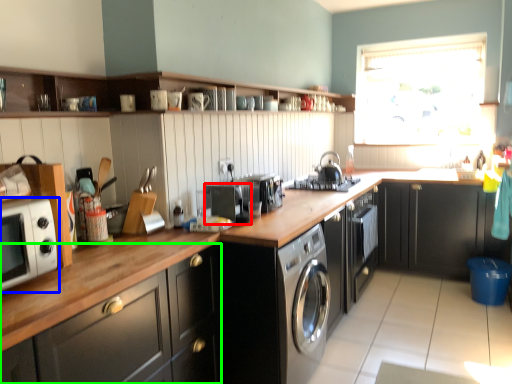
Question: Based on their relative distances, which object is farther from appliance (highlighted by a red box)? Choose from home appliance (highlighted by a blue box) and cabinetry (highlighted by a green box).

Choices:
 (A) home appliance
 (B) cabinetry

Answer: (A)